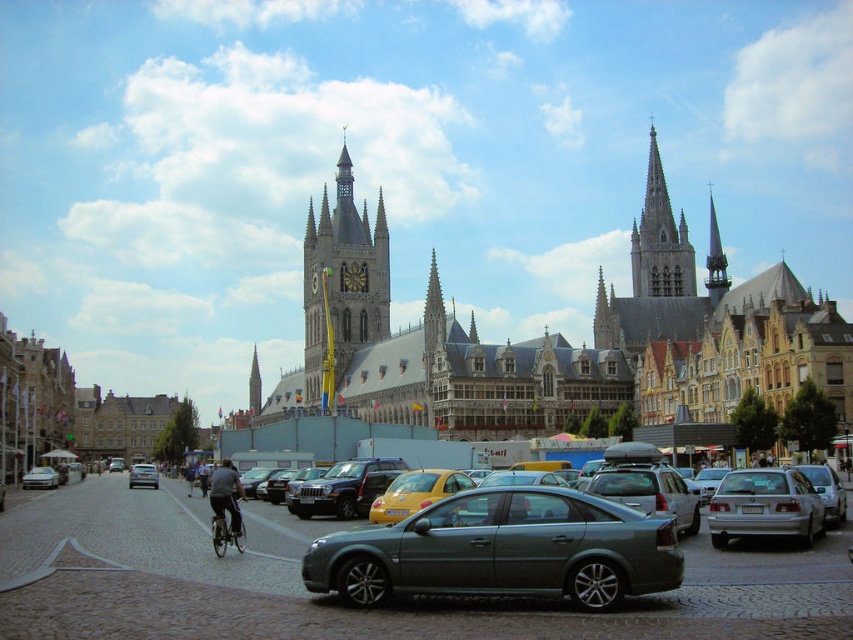
Question: Which object is positioned closest to the silver metallic sedan at right?

Choices:
 (A) stone gray church at center
 (B) silver metallic bicycle at center
 (C) silver metallic sedan at lower left

Answer: (B)

Question: Is stone gray church at center positioned behind silver metallic sedan at lower left?

Choices:
 (A) no
 (B) yes

Answer: (A)

Question: Based on their relative distances, which object is farther from the golden stone clock tower at center?

Choices:
 (A) silver metallic sedan at right
 (B) silver metallic sedan at lower left

Answer: (A)

Question: Is stone gray church at center above golden stone clock tower at center?

Choices:
 (A) yes
 (B) no

Answer: (A)

Question: Which object is closer to the camera taking this photo?

Choices:
 (A) stone gray church at center
 (B) golden stone clock tower at center
 (C) silver metallic sedan at right

Answer: (C)

Question: Is the position of metallic gray sedan at center more distant than that of silver metallic bicycle at center?

Choices:
 (A) no
 (B) yes

Answer: (A)